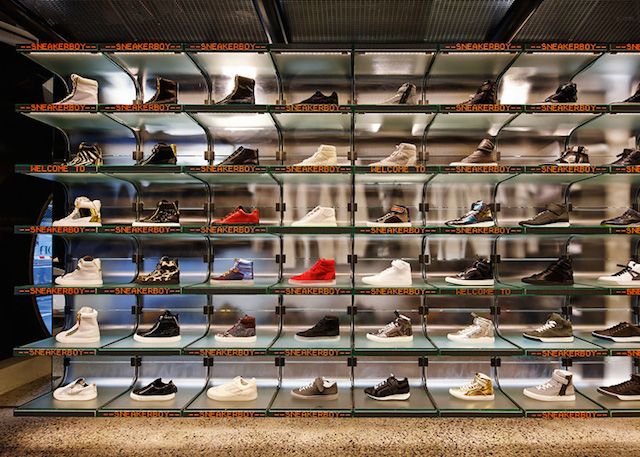
Locate an element on the screen. This screenshot has height=457, width=640. 7th shelve is located at coordinates (60, 45), (137, 45), (212, 45), (294, 46), (364, 51), (454, 44), (624, 46).